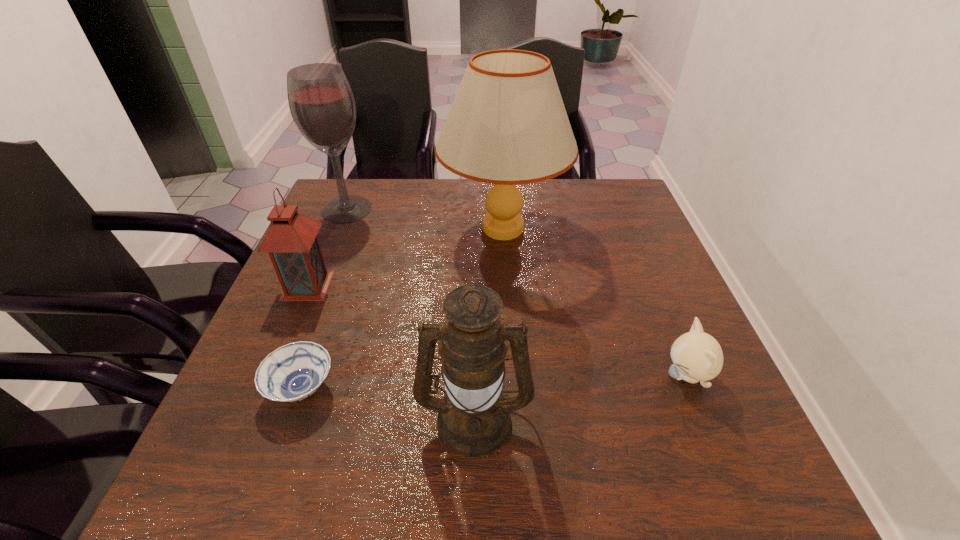
Where is `lantern at the left edge`? lantern at the left edge is located at coordinates (292, 244).

Identify the location of soup bowl present at the left edge. The width and height of the screenshot is (960, 540). (293, 372).

Find the location of `object situated at the right edge`. object situated at the right edge is located at coordinates (697, 356).

Locate an element on the screen. Image resolution: width=960 pixels, height=540 pixels. object that is at the far left corner is located at coordinates point(321,102).

Identify the location of vacant space at the far edge of the desktop. The height and width of the screenshot is (540, 960). pyautogui.click(x=440, y=187).

This screenshot has height=540, width=960. What are the coordinates of `vacant space at the near edge of the desktop` in the screenshot? It's located at (344, 455).

In the image, there is a desktop. In order to click on free space at the left edge in this screenshot , I will do `click(271, 345)`.

Locate an element on the screen. Image resolution: width=960 pixels, height=540 pixels. vacant region at the right edge of the desktop is located at coordinates (657, 313).

The width and height of the screenshot is (960, 540). I want to click on free space at the near left corner, so pyautogui.click(x=226, y=469).

At what (x,y) coordinates should I click in order to perform the action: click on free space at the far right corner of the desktop. Please return your answer as a coordinate pair (x, y). Looking at the image, I should click on (615, 212).